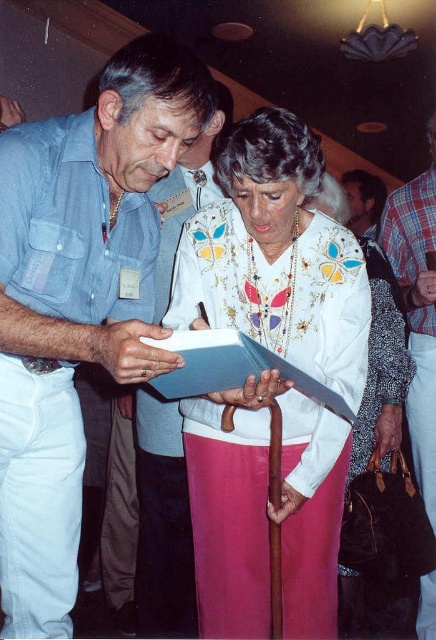
Does white embroidered blouse at center come in front of plaid fabric shirt at right?

Yes, white embroidered blouse at center is in front of plaid fabric shirt at right.

Looking at this image, is white embroidered blouse at center shorter than plaid fabric shirt at right?

Yes, white embroidered blouse at center is shorter than plaid fabric shirt at right.

Is point (296, 228) in front of point (433, 396)?

Yes, point (296, 228) is closer to viewer.

Locate an element on the screen. The height and width of the screenshot is (640, 436). white embroidered blouse at center is located at coordinates pyautogui.click(x=275, y=257).

What do you see at coordinates (231, 368) in the screenshot? I see `blue paper clipboard at center` at bounding box center [231, 368].

Can you confirm if blue paper clipboard at center is wider than smooth brown leather jacket at upper center?

Yes, blue paper clipboard at center is wider than smooth brown leather jacket at upper center.

The width and height of the screenshot is (436, 640). What do you see at coordinates (231, 368) in the screenshot?
I see `blue paper clipboard at center` at bounding box center [231, 368].

What are the coordinates of `blue paper clipboard at center` in the screenshot? It's located at (231, 368).

Does plaid fabric shirt at right have a lesser width compared to blue paper clipboard at center?

Yes.

How far apart are plaid fabric shirt at right and blue paper clipboard at center?

plaid fabric shirt at right and blue paper clipboard at center are 1.04 meters apart.

Does point (432, 356) come behind point (201, 380)?

That is True.

Locate an element on the screen. plaid fabric shirt at right is located at coordinates (418, 308).